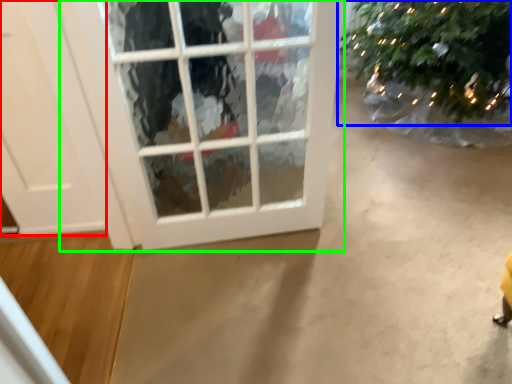
Question: Estimate the real-world distances between objects in this image. Which object is closer to door (highlighted by a red box), christmas tree (highlighted by a blue box) or window (highlighted by a green box)?

Choices:
 (A) christmas tree
 (B) window

Answer: (B)